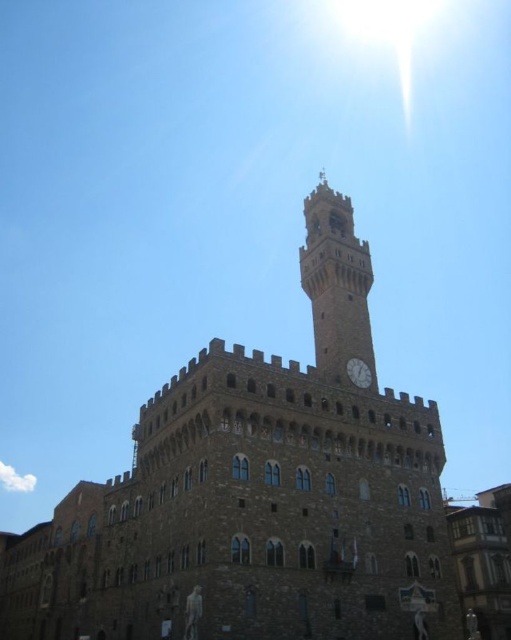
Can you confirm if stone clock tower at center is smaller than white glossy clock at center?

No, stone clock tower at center is not smaller than white glossy clock at center.

Which is below, stone clock tower at center or white glossy clock at center?

white glossy clock at center is below.

Which is behind, point (365, 282) or point (353, 365)?

The point (365, 282) is behind.

Locate an element on the screen. stone clock tower at center is located at coordinates (336, 284).

Is point (327, 342) farther from viewer compared to point (336, 380)?

Yes.

The image size is (511, 640). Describe the element at coordinates (257, 496) in the screenshot. I see `brown stone castle at center` at that location.

You are a GUI agent. You are given a task and a screenshot of the screen. Output one action in this format:
    pyautogui.click(x=<x>, y=<y>)
    Task: Click on the brown stone castle at center
    
    Given the screenshot: What is the action you would take?
    pyautogui.click(x=257, y=496)

Between point (230, 547) and point (364, 369), which one is positioned in front?

Point (230, 547)

Is brown stone castle at center wider than white glossy clock at center?

Yes.

This screenshot has width=511, height=640. What are the coordinates of `brown stone castle at center` in the screenshot? It's located at (257, 496).

This screenshot has height=640, width=511. In order to click on brown stone castle at center in this screenshot , I will do `click(257, 496)`.